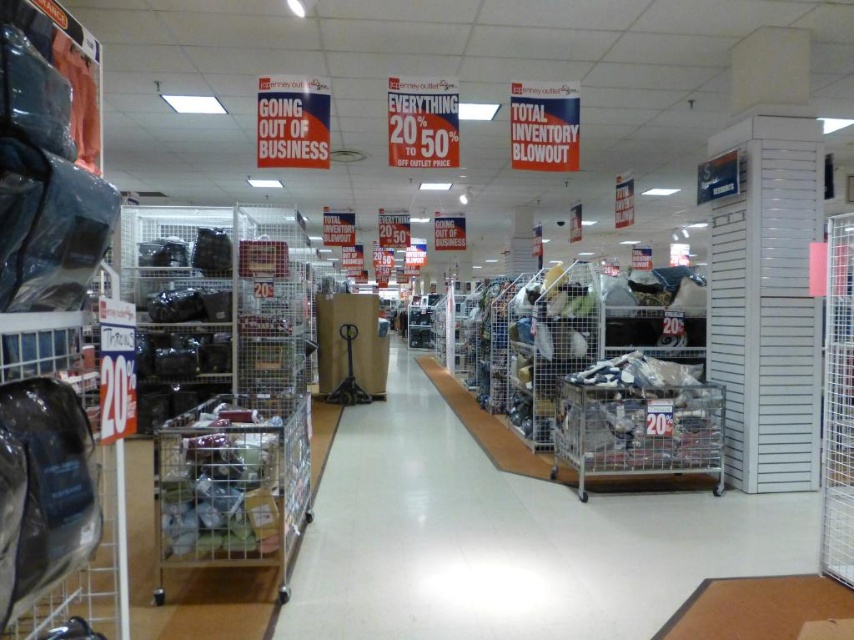
Question: Based on their relative distances, which object is farther from the metal mesh cart at center?

Choices:
 (A) metallic silver cart at center
 (B) metallic silver shopping cart at center

Answer: (B)

Question: Observing the image, what is the correct spatial positioning of metallic silver shopping cart at center in reference to metallic silver cart at center?

Choices:
 (A) below
 (B) above

Answer: (B)

Question: Can you confirm if metallic silver shopping cart at center is smaller than metallic silver cart at center?

Choices:
 (A) yes
 (B) no

Answer: (B)

Question: Which of these objects is positioned closest to the metallic silver cart at center?

Choices:
 (A) metal mesh cart at center
 (B) metallic silver shopping cart at center

Answer: (A)

Question: Which object appears closest to the camera in this image?

Choices:
 (A) metallic silver shopping cart at center
 (B) metal mesh cart at center
 (C) metallic silver cart at center

Answer: (A)

Question: Does metal mesh cart at center have a larger size compared to metallic silver cart at center?

Choices:
 (A) no
 (B) yes

Answer: (A)